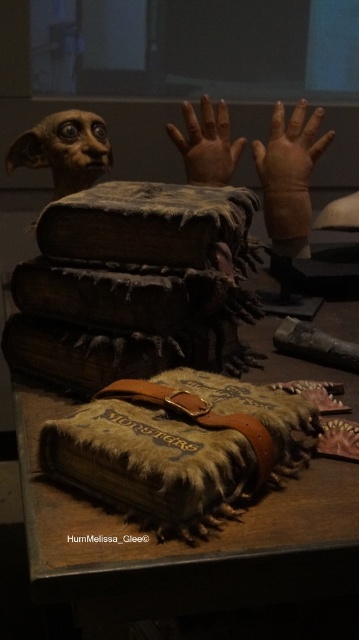
Can you confirm if wooden table at center is positioned to the left of leather-like hand at center?

Correct, you'll find wooden table at center to the left of leather-like hand at center.

Does wooden table at center appear on the right side of leather-like hand at center?

Incorrect, wooden table at center is not on the right side of leather-like hand at center.

Between point (95, 536) and point (291, 237), which one is positioned in front?

Point (95, 536)

You are a GUI agent. You are given a task and a screenshot of the screen. Output one action in this format:
    pyautogui.click(x=<x>, y=<y>)
    Task: Click on the wooden table at center
    This screenshot has width=359, height=640.
    Given the screenshot: What is the action you would take?
    pyautogui.click(x=183, y=541)

Between fuzzy leather book at center and fuzzy brown book at center, which one is positioned higher?

Positioned higher is fuzzy leather book at center.

Is fuzzy leather book at center below fuzzy brown book at center?

No.

Which is in front, point (89, 376) or point (171, 483)?

Point (171, 483) is more forward.

I want to click on fuzzy leather book at center, so tap(132, 273).

How much distance is there between fuzzy leather book at center and smooth beige hand at center?

A distance of 24.89 inches exists between fuzzy leather book at center and smooth beige hand at center.

Which of these two, fuzzy leather book at center or smooth beige hand at center, stands shorter?

smooth beige hand at center is shorter.

Is point (86, 244) less distant than point (202, 160)?

Yes, point (86, 244) is in front of point (202, 160).

Identify the location of fuzzy leather book at center. The height and width of the screenshot is (640, 359). (132, 273).